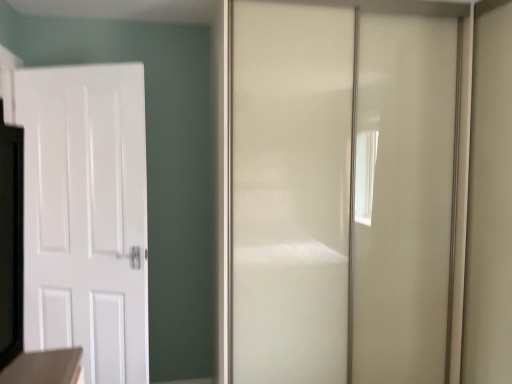
Question: Should I look upward or downward to see glossy white door at center, placed as the second door when sorted from left to right?

Choices:
 (A) up
 (B) down

Answer: (B)

Question: Is white matte door at left, which appears as the first door when viewed from the left, turned away from glossy white door at center, the first door positioned from the right?

Choices:
 (A) no
 (B) yes

Answer: (A)

Question: Considering the relative positions of white matte door at left, which ranks as the 2th door in right-to-left order, and glossy white door at center, placed as the second door when sorted from left to right, in the image provided, is white matte door at left, which ranks as the 2th door in right-to-left order, to the right of glossy white door at center, placed as the second door when sorted from left to right, from the viewer's perspective?

Choices:
 (A) no
 (B) yes

Answer: (A)

Question: From a real-world perspective, is white matte door at left, which appears as the first door when viewed from the left, positioned over glossy white door at center, placed as the second door when sorted from left to right, based on gravity?

Choices:
 (A) yes
 (B) no

Answer: (B)

Question: Can we say white matte door at left, which appears as the first door when viewed from the left, lies outside glossy white door at center, the first door positioned from the right?

Choices:
 (A) no
 (B) yes

Answer: (B)

Question: Would you say white matte door at left, which appears as the first door when viewed from the left, is a long distance from glossy white door at center, placed as the second door when sorted from left to right?

Choices:
 (A) no
 (B) yes

Answer: (A)

Question: Does white matte door at left, which ranks as the 2th door in right-to-left order, have a greater height compared to glossy white door at center, the first door positioned from the right?

Choices:
 (A) no
 (B) yes

Answer: (A)

Question: From the image's perspective, is glossy white door at center, the first door positioned from the right, over white matte door at left, which ranks as the 2th door in right-to-left order?

Choices:
 (A) yes
 (B) no

Answer: (A)

Question: Does glossy white door at center, placed as the second door when sorted from left to right, have a lesser width compared to white matte door at left, which appears as the first door when viewed from the left?

Choices:
 (A) no
 (B) yes

Answer: (A)

Question: From the image's perspective, is glossy white door at center, the first door positioned from the right, located beneath white matte door at left, which ranks as the 2th door in right-to-left order?

Choices:
 (A) no
 (B) yes

Answer: (A)

Question: From a real-world perspective, is glossy white door at center, placed as the second door when sorted from left to right, beneath white matte door at left, which ranks as the 2th door in right-to-left order?

Choices:
 (A) no
 (B) yes

Answer: (A)

Question: From a real-world perspective, is glossy white door at center, the first door positioned from the right, on top of white matte door at left, which appears as the first door when viewed from the left?

Choices:
 (A) no
 (B) yes

Answer: (B)

Question: Can you confirm if glossy white door at center, placed as the second door when sorted from left to right, is bigger than white matte door at left, which ranks as the 2th door in right-to-left order?

Choices:
 (A) yes
 (B) no

Answer: (A)

Question: Is glossy white door at center, placed as the second door when sorted from left to right, in front of or behind white matte door at left, which appears as the first door when viewed from the left, in the image?

Choices:
 (A) front
 (B) behind

Answer: (A)